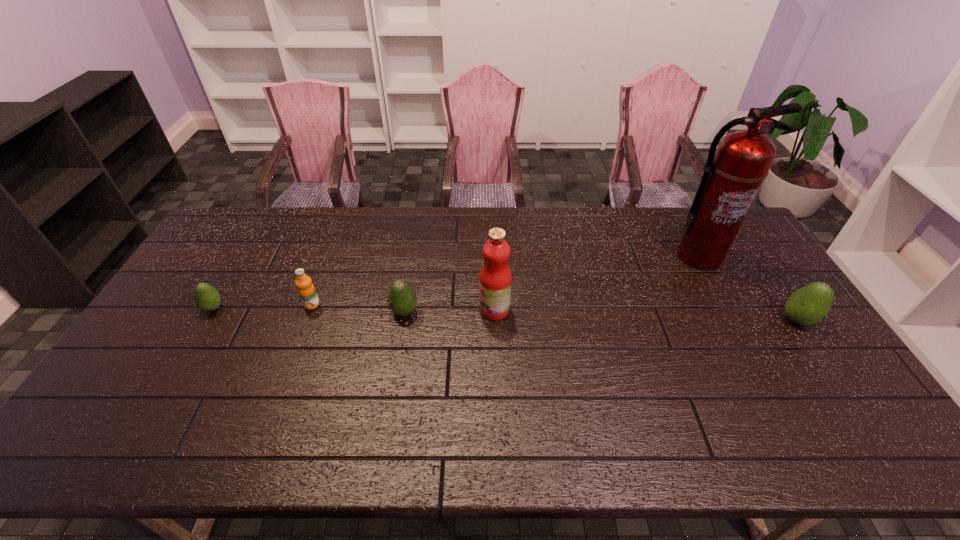
At what (x,y) coordinates should I click in order to perform the action: click on free point between the shortest avocado and the second object from left to right. Please return your answer as a coordinate pair (x, y). The image size is (960, 540). Looking at the image, I should click on (263, 306).

Image resolution: width=960 pixels, height=540 pixels. I want to click on free space between the fifth shortest object and the fire extinguisher, so click(x=596, y=283).

I want to click on unoccupied area between the second object from left to right and the rightmost object, so click(555, 313).

Locate an element on the screen. The height and width of the screenshot is (540, 960). blank region between the tallest object and the shortest avocado is located at coordinates (456, 282).

At what (x,y) coordinates should I click in order to perform the action: click on vacant region between the second object from left to right and the rightmost avocado. Please return your answer as a coordinate pair (x, y). The image size is (960, 540). Looking at the image, I should click on (555, 313).

The image size is (960, 540). In order to click on object that is the fifth closest to the leftmost avocado in this screenshot , I will do `click(808, 305)`.

The image size is (960, 540). I want to click on the third closest object to the rightmost object, so click(402, 299).

Identify which avocado is the closest to the rightmost object. Please provide its 2D coordinates. Your answer should be formatted as a tuple, i.e. [(x, y)], where the tuple contains the x and y coordinates of a point satisfying the conditions above.

[(402, 299)]

Locate which avocado ranks in proximity to the third object from left to right. Please provide its 2D coordinates. Your answer should be formatted as a tuple, i.e. [(x, y)], where the tuple contains the x and y coordinates of a point satisfying the conditions above.

[(207, 298)]

The width and height of the screenshot is (960, 540). What are the coordinates of `free space that satisfies the following two spatial constraints: 1. on the label of the rightmost object; 2. on the right side of the fifth object from right to left` in the screenshot? It's located at (306, 320).